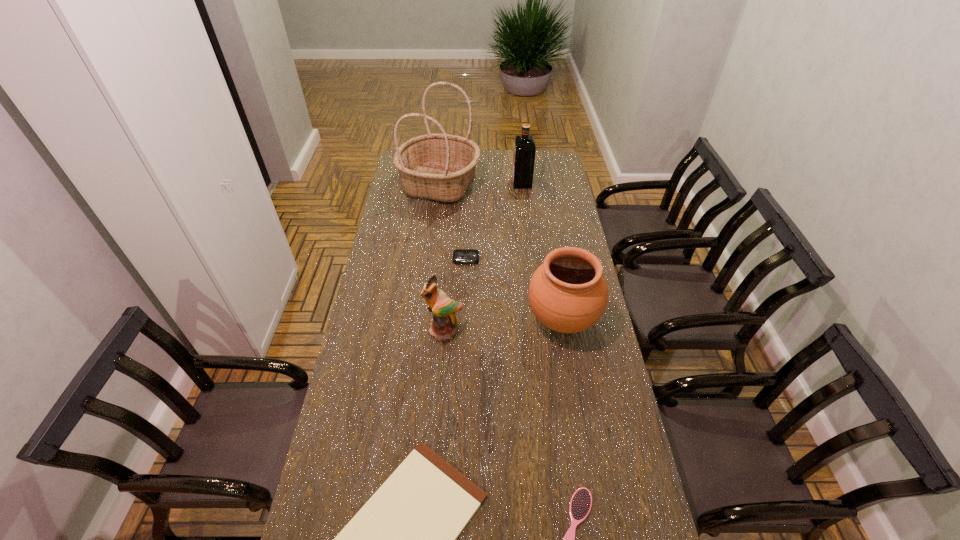
At what (x,y) coordinates should I click in order to perform the action: click on blank space located 0.370m on the front-facing side of the parrot. Please return your answer as a coordinate pair (x, y). The height and width of the screenshot is (540, 960). Looking at the image, I should click on (435, 448).

At what (x,y) coordinates should I click in order to perform the action: click on free space located 0.340m on the left of the pottery. Please return your answer as a coordinate pair (x, y). Looking at the image, I should click on (433, 320).

I want to click on vacant space situated on the display of the alarm clock, so click(x=464, y=330).

Where is `object that is at the far edge`? object that is at the far edge is located at coordinates (440, 167).

The width and height of the screenshot is (960, 540). In order to click on object present at the left edge in this screenshot , I will do `click(440, 167)`.

This screenshot has height=540, width=960. Identify the location of object present at the right edge. (568, 293).

Where is `object that is at the far left corner`? object that is at the far left corner is located at coordinates [440, 167].

Where is `vacant space at the far edge`? This screenshot has height=540, width=960. vacant space at the far edge is located at coordinates (488, 170).

Where is `vacant space at the left edge`? The height and width of the screenshot is (540, 960). vacant space at the left edge is located at coordinates (388, 298).

The height and width of the screenshot is (540, 960). I want to click on free space at the right edge of the desktop, so click(x=591, y=387).